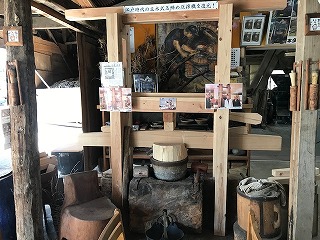
What are the coordinates of `cylindrical container` in the screenshot? It's located at (263, 213), (170, 172).